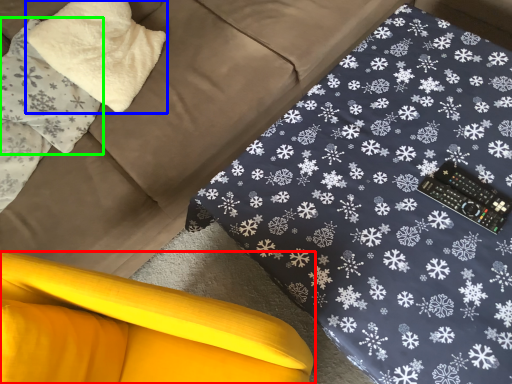
Question: Which object is the closest to the furniture (highlighted by a red box)? Choose among these: pillow (highlighted by a blue box) or pillow (highlighted by a green box).

Choices:
 (A) pillow
 (B) pillow

Answer: (B)